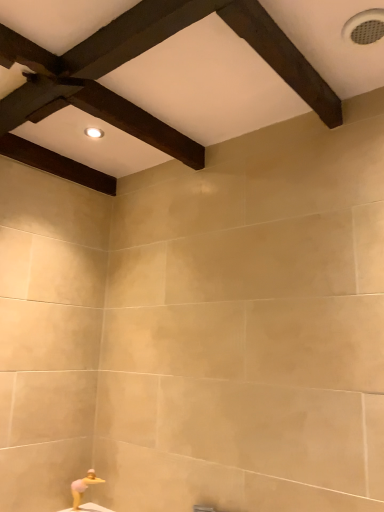
I want to click on pink fabric person at lower left, so click(x=83, y=487).

Measure the distance between pink fabric person at lower left and camera.

1.83 meters.

Describe the element at coordinates (83, 487) in the screenshot. I see `pink fabric person at lower left` at that location.

Locate an element on the screen. pink fabric person at lower left is located at coordinates (83, 487).